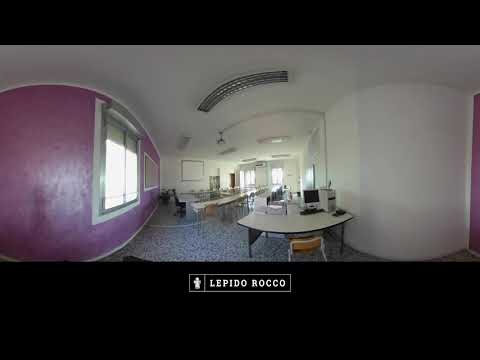
Image resolution: width=480 pixels, height=360 pixels. I want to click on purple wall, so click(55, 177), click(147, 198), click(150, 148), click(477, 198).